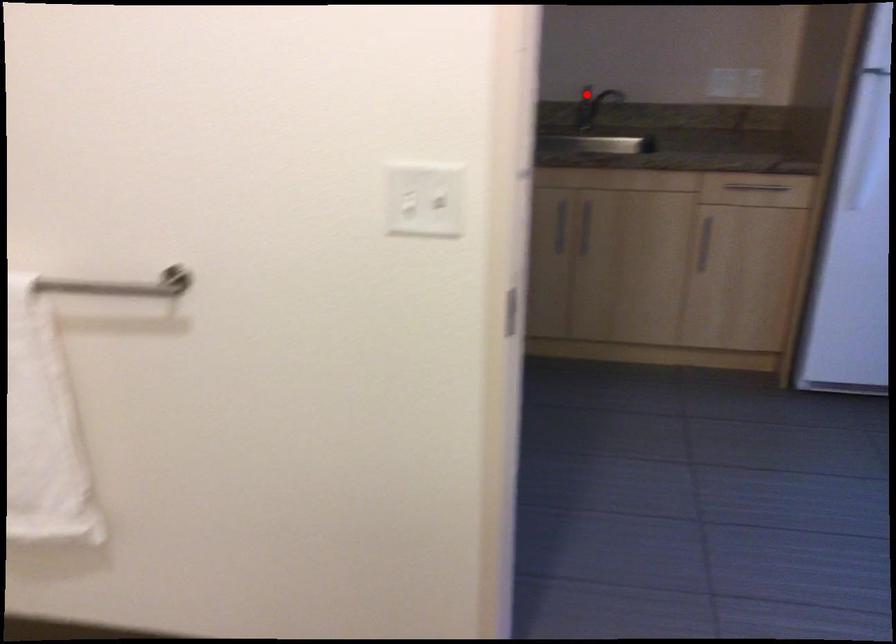
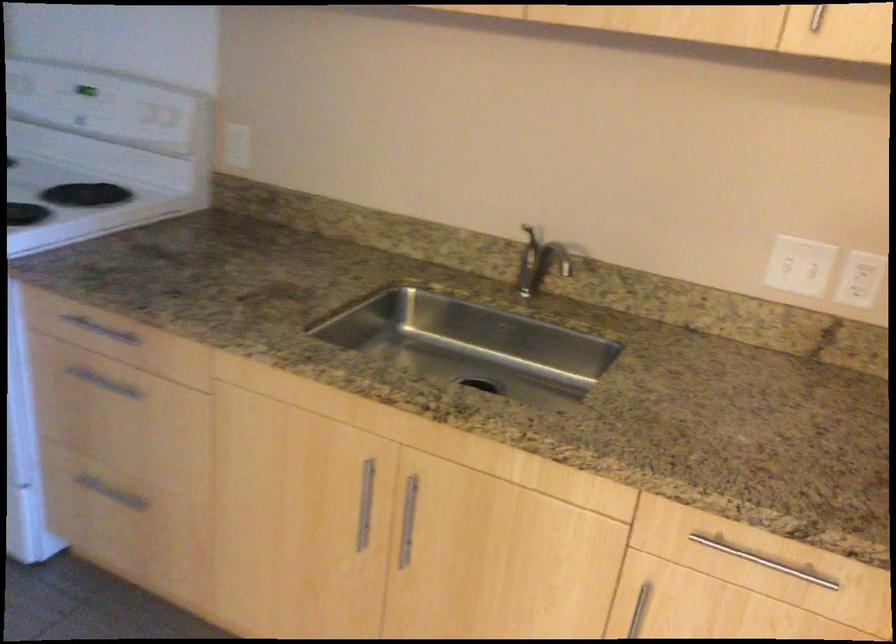
Question: I am providing you with two images of the same scene from different viewpoints. In image1, a red point is highlighted. Considering the same 3D point in image2, which of the following is correct?

Choices:
 (A) It is closer
 (B) It is farther

Answer: (A)